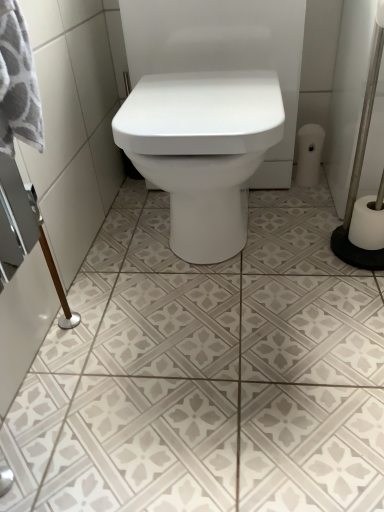
Locate an element on the screen. The image size is (384, 512). free space in front of white matte toilet paper at right, the 1th toilet paper positioned from the left is located at coordinates (305, 203).